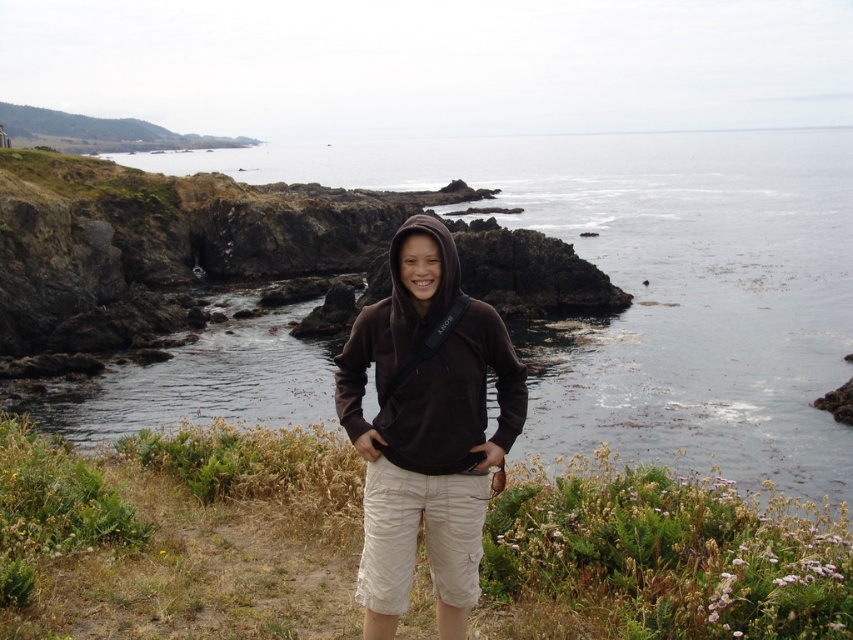
Based on the photo, you are a photographer trying to capture the rugged cliffs in the background. You have two hoodies, the brown cotton hoodie at center and the brown fleece hoodie at center, in your view. Which hoodie should you focus on to ensure the cliffs are clearly visible in your photo?

The brown cotton hoodie at center is further to the viewer than the brown fleece hoodie at center, so focusing on the brown cotton hoodie at center will place the cliffs further back and more clearly visible in the background.

You are a photographer planning to take a wide landscape shot of the clear water at center and the brown cotton hoodie at center. Your camera has a maximum focus range of 120 meters. Will you be able to capture both objects in focus at the same time?

The distance between the clear water at center and the brown cotton hoodie at center is 119.32 meters, which is within the camera maximum focus range of 120 meters. Therefore, both objects can be captured in focus simultaneously.